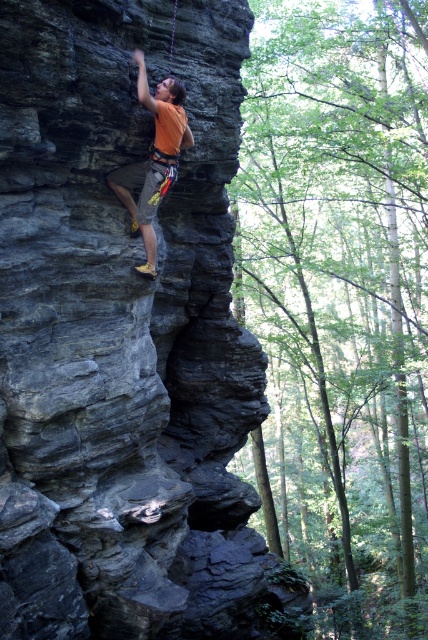
You are a climber trying to secure your position on the dark gray stone cliff at center. You notice the orange fabric climbing harness at upper center. Considering their sizes, which object would provide more stability for your climbing gear?

The dark gray stone cliff at center has a larger size compared to the orange fabric climbing harness at upper center, so it would provide more stability for the climbing gear.

You are a climber who wants to reach the top of the dark gray stone cliff at center. You notice the orange fabric climbing harness at upper center attached to your waist. Can you determine if the cliff is tall enough to allow you to climb using the harness?

The dark gray stone cliff at center is taller than the orange fabric climbing harness at upper center, so yes, the cliff is tall enough to allow you to climb using the harness.

You are a rock climber assessing the climbing route. You notice the dark gray stone cliff at center and the orange fabric climbing harness at upper center. Which object is wider?

The dark gray stone cliff at center is wider than the orange fabric climbing harness at upper center.